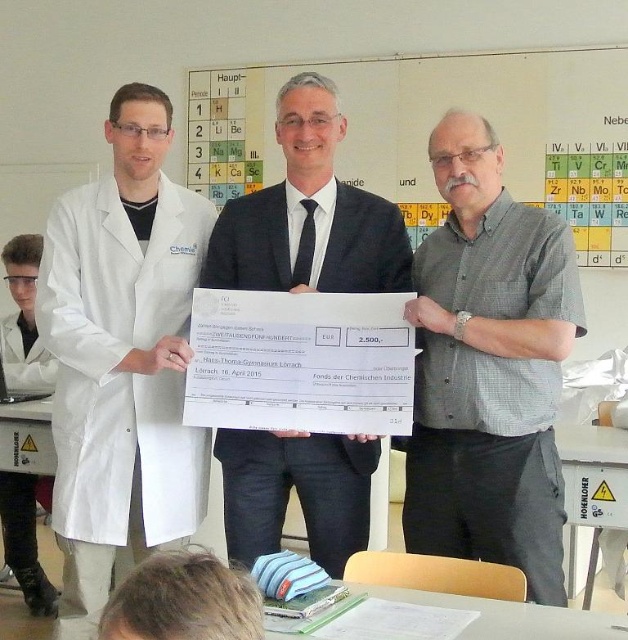
Question: Which of the following is the farthest from the observer?

Choices:
 (A) white lab coat at center
 (B) yellow periodic table at upper center
 (C) white lab coat at left
 (D) gray checkered shirt at center

Answer: (B)

Question: Is gray checkered shirt at center positioned in front of yellow periodic table at upper center?

Choices:
 (A) no
 (B) yes

Answer: (B)

Question: Which object is closer to the camera taking this photo?

Choices:
 (A) yellow periodic table at upper center
 (B) gray checkered shirt at center

Answer: (B)

Question: Estimate the real-world distances between objects in this image. Which object is closer to the gray checkered shirt at center?

Choices:
 (A) yellow periodic table at upper center
 (B) white lab coat at left

Answer: (B)

Question: Does white lab coat at left have a greater width compared to yellow periodic table at upper center?

Choices:
 (A) yes
 (B) no

Answer: (B)

Question: In this image, where is white lab coat at left located relative to yellow periodic table at upper center?

Choices:
 (A) above
 (B) below

Answer: (B)